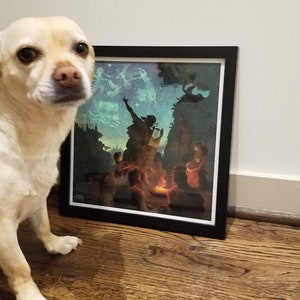
Locate an element on the screen. Image resolution: width=300 pixels, height=300 pixels. floor is located at coordinates (165, 280).